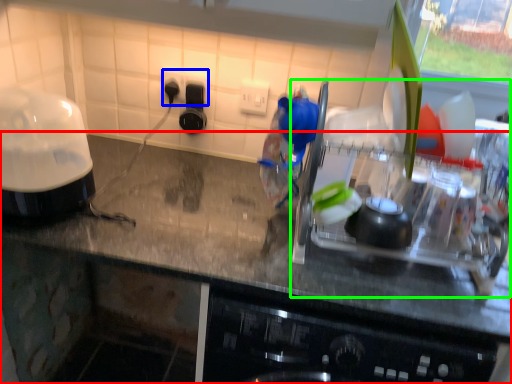
Question: Estimate the real-world distances between objects in this image. Which object is closer to countertop (highlighted by a red box), electric outlet (highlighted by a blue box) or appliance (highlighted by a green box)?

Choices:
 (A) electric outlet
 (B) appliance

Answer: (B)